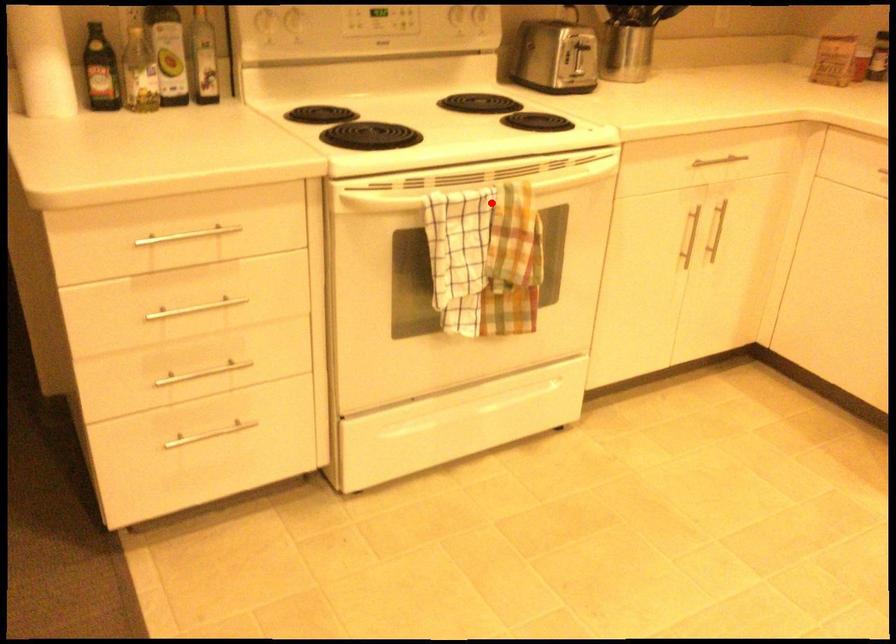
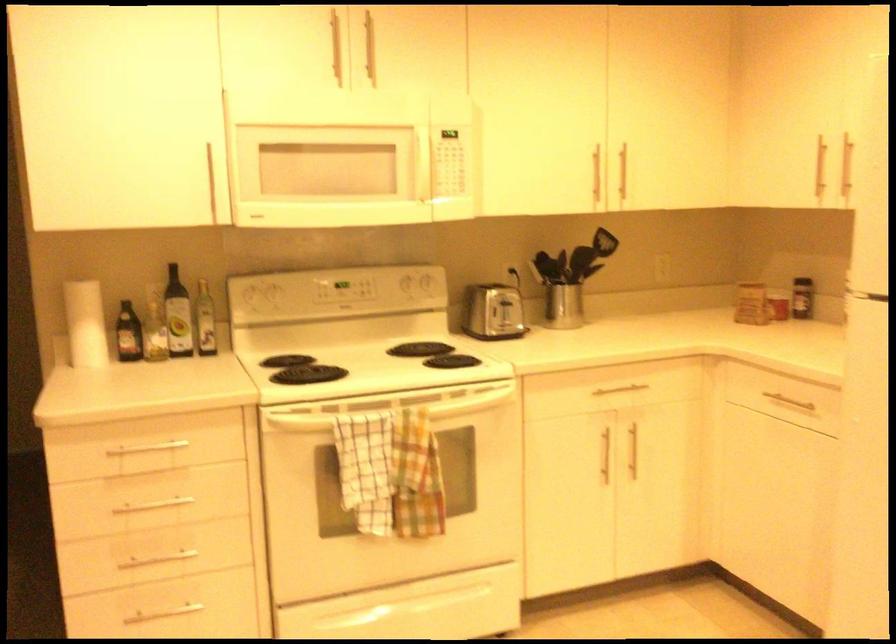
Question: I am providing you with two images of the same scene from different viewpoints. A red point is marked on the first image. Can you still see the location of the red point in image 2?

Choices:
 (A) Yes
 (B) No

Answer: (A)